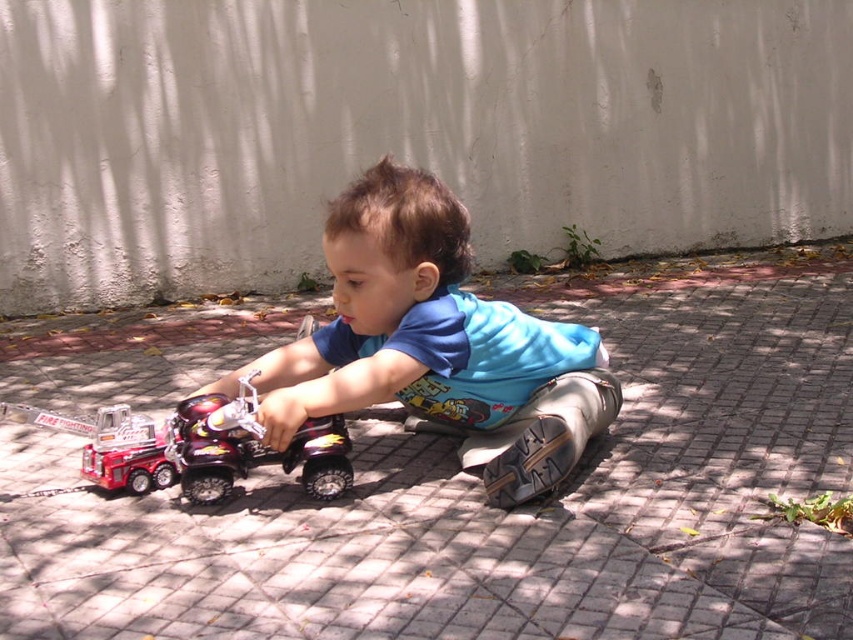
Question: Does brick pavement at center appear on the left side of metallic red fire truck at left?

Choices:
 (A) no
 (B) yes

Answer: (A)

Question: From the image, what is the correct spatial relationship of metallic red fire truck at left in relation to metallic red fire truck at lower left?

Choices:
 (A) above
 (B) below

Answer: (A)

Question: Which of the following is the farthest from the observer?

Choices:
 (A) metallic red fire truck at lower left
 (B) blue cotton shirt at center
 (C) metallic red fire truck at left

Answer: (A)

Question: Is blue cotton shirt at center positioned at the back of metallic red fire truck at lower left?

Choices:
 (A) yes
 (B) no

Answer: (B)

Question: Among these objects, which one is farthest from the camera?

Choices:
 (A) metallic red fire truck at left
 (B) metallic red fire truck at lower left
 (C) brick pavement at center

Answer: (B)

Question: Which point appears closest to the camera in this image?

Choices:
 (A) (187, 529)
 (B) (106, 433)
 (C) (120, 412)

Answer: (A)